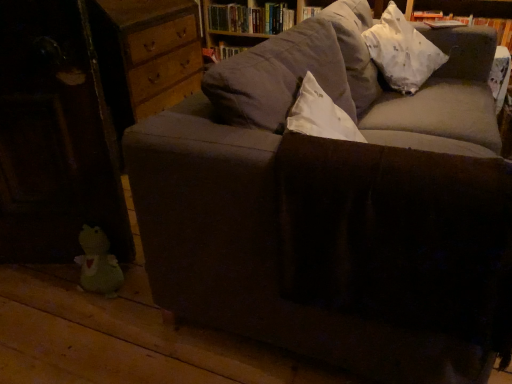
Question: Relative to white paper book at upper right, the 2th book positioned from the left, is hardcover books at upper center, placed as the first book when sorted from left to right, in front or behind?

Choices:
 (A) behind
 (B) front

Answer: (A)

Question: Considering the positions of hardcover books at upper center, arranged as the second book when viewed from the right, and white paper book at upper right, which is counted as the first book, starting from the front, in the image, is hardcover books at upper center, arranged as the second book when viewed from the right, taller or shorter than white paper book at upper right, which is counted as the first book, starting from the front,?

Choices:
 (A) tall
 (B) short

Answer: (A)

Question: Estimate the real-world distances between objects in this image. Which object is closer to the hardcover books at upper center, arranged as the second book when viewed from the right?

Choices:
 (A) green plush toy at lower left
 (B) white fabric pillow at upper right
 (C) white paper book at upper right, the 2th book positioned from the left

Answer: (C)

Question: Which object is the closest to the white fabric pillow at upper right?

Choices:
 (A) hardcover books at upper center, placed as the first book when sorted from left to right
 (B) white paper book at upper right, marked as the 2th book in a back-to-front arrangement
 (C) green plush toy at lower left

Answer: (B)